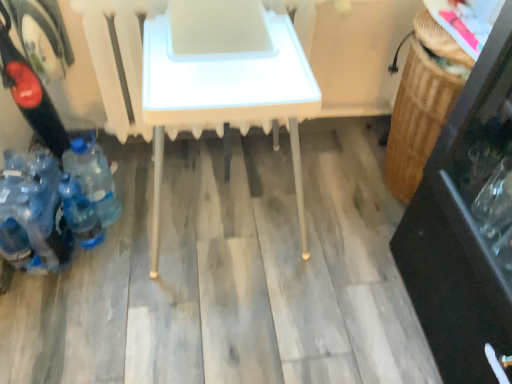
Find the location of a particular element. vacant space to the right of blue plastic bottle at lower left, the 3th bottle positioned from the left is located at coordinates (144, 217).